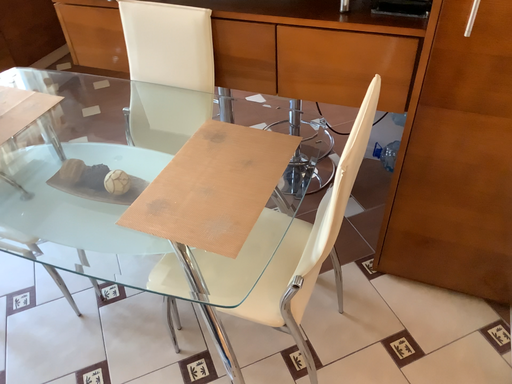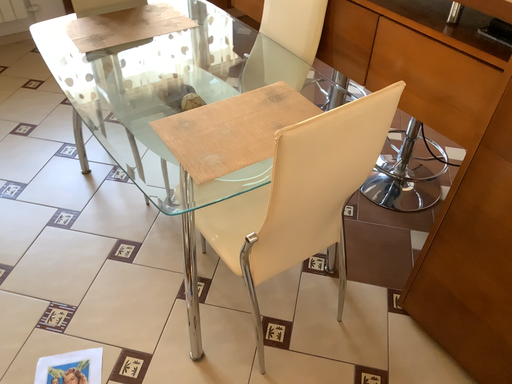
Question: Which way did the camera rotate in the video?

Choices:
 (A) rotated right
 (B) rotated left

Answer: (B)